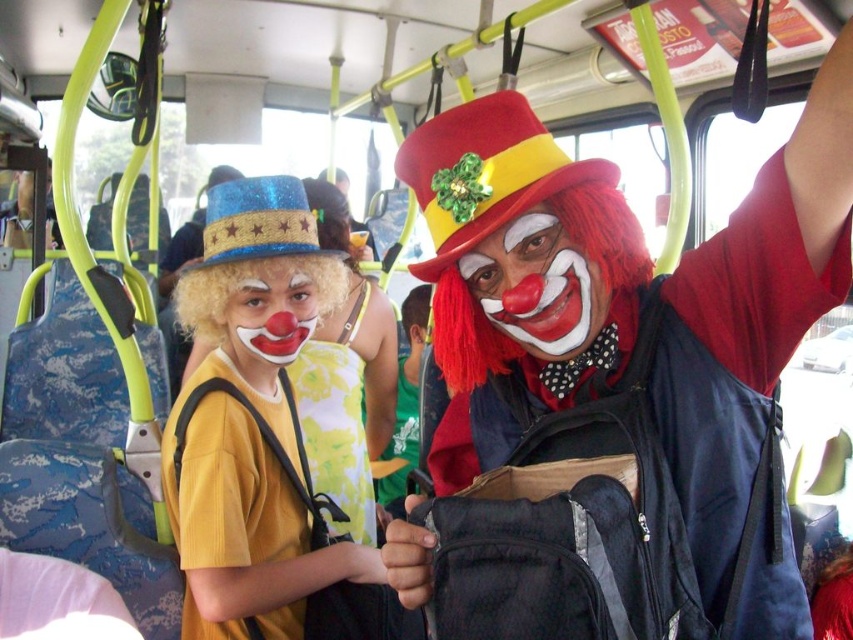
Does point (766, 488) come farther from viewer compared to point (271, 342)?

No, (766, 488) is closer to viewer.

Is point (589, 484) more distant than point (271, 280)?

No, (589, 484) is in front of (271, 280).

Find the location of `matte red clown at upper right`. matte red clown at upper right is located at coordinates (613, 385).

Can you confirm if matte clown nose at center is bigger than green jersey at center?

No.

Which is behind, point (247, 339) or point (425, 314)?

Positioned behind is point (425, 314).

Is point (260, 259) positioned behind point (410, 374)?

No, (260, 259) is in front of (410, 374).

The width and height of the screenshot is (853, 640). Identify the location of matte clown nose at center. (270, 314).

Can you confirm if matte clown face at center is smaller than matte clown nose at center?

Correct, matte clown face at center occupies less space than matte clown nose at center.

Is point (508, 269) behind point (280, 301)?

No, (508, 269) is in front of (280, 301).

You are a GUI agent. You are given a task and a screenshot of the screen. Output one action in this format:
    pyautogui.click(x=<x>, y=<y>)
    Task: Click on the matte clown face at center
    The image size is (853, 640).
    Given the screenshot: What is the action you would take?
    pyautogui.click(x=537, y=285)